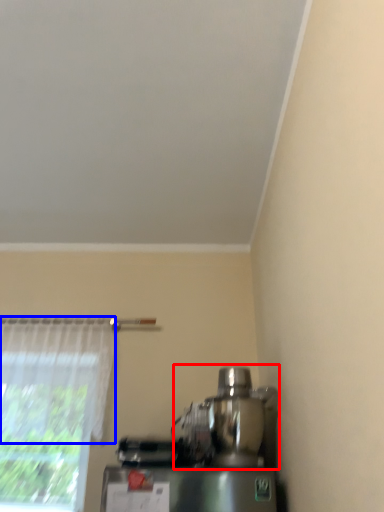
Question: Which object is closer to the camera taking this photo, mixer (highlighted by a red box) or curtain (highlighted by a blue box)?

Choices:
 (A) mixer
 (B) curtain

Answer: (A)